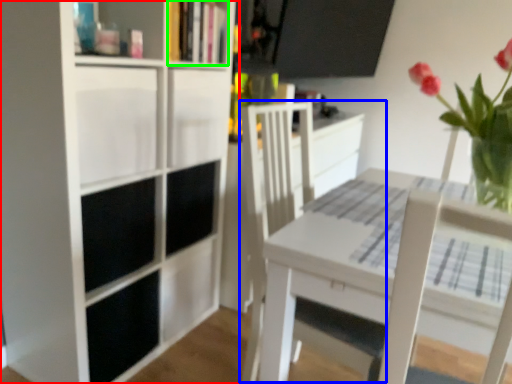
Question: Which object is positioned farthest from bookcase (highlighted by a red box)? Select from swivel chair (highlighted by a blue box) and book (highlighted by a green box).

Choices:
 (A) swivel chair
 (B) book

Answer: (A)